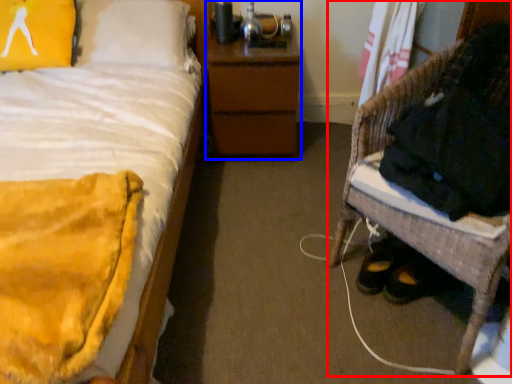
Question: Which object appears closest to the camera in this image, furniture (highlighted by a red box) or nightstand (highlighted by a blue box)?

Choices:
 (A) furniture
 (B) nightstand

Answer: (A)